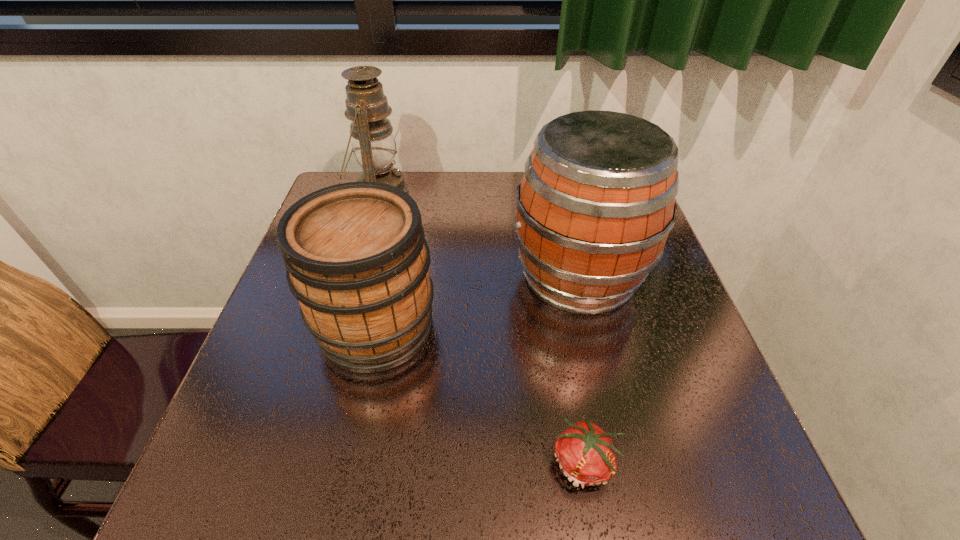
Locate an element on the screen. The height and width of the screenshot is (540, 960). free space between the shortest object and the farthest object is located at coordinates (482, 328).

Point out which object is positioned as the third nearest to the taller cider. Please provide its 2D coordinates. Your answer should be formatted as a tuple, i.e. [(x, y)], where the tuple contains the x and y coordinates of a point satisfying the conditions above.

[(374, 146)]

This screenshot has height=540, width=960. Identify the location of object that stands as the second closest to the right cider. (586, 455).

Identify the location of free region that satisfies the following two spatial constraints: 1. on the front side of the shorter cider; 2. on the right side of the farthest object. (341, 326).

Identify the location of vacant point that satisfies the following two spatial constraints: 1. on the front side of the oil lamp; 2. on the right side of the nearest object. (300, 463).

At what (x,y) coordinates should I click in order to perform the action: click on free space that satisfies the following two spatial constraints: 1. on the front side of the oil lamp; 2. on the left side of the tomato. Please return your answer as a coordinate pair (x, y). The image size is (960, 540). Looking at the image, I should click on (300, 463).

Find the location of a particular element. The image size is (960, 540). vacant space that satisfies the following two spatial constraints: 1. on the front side of the nearest object; 2. on the left side of the oil lamp is located at coordinates (300, 463).

Locate an element on the screen. Image resolution: width=960 pixels, height=540 pixels. free region that satisfies the following two spatial constraints: 1. on the front side of the left cider; 2. on the left side of the farthest object is located at coordinates (341, 326).